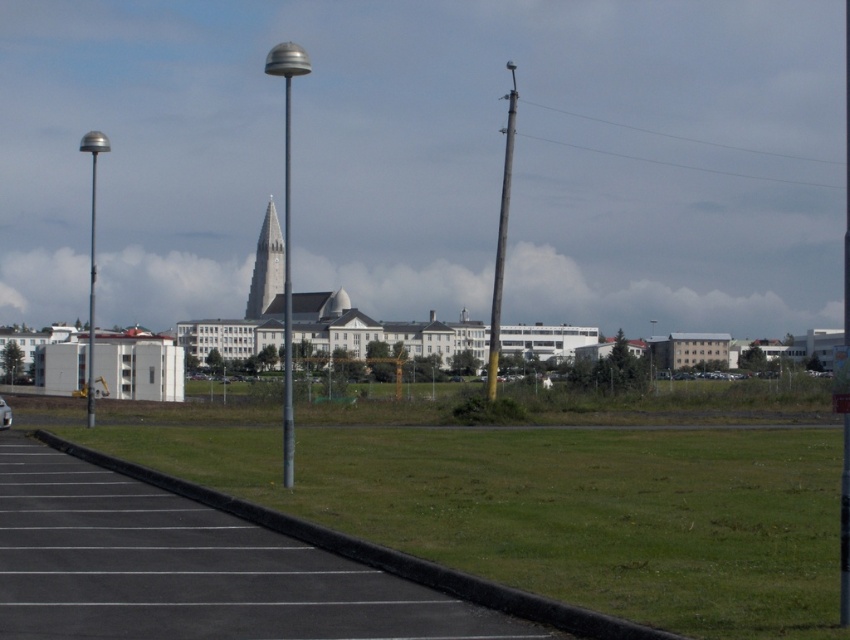
Can you confirm if smooth gray spire at center is positioned to the left of white glossy car at center?

Correct, you'll find smooth gray spire at center to the left of white glossy car at center.

Who is higher up, smooth gray spire at center or white glossy car at center?

smooth gray spire at center is higher up.

Is point (262, 284) in front of point (3, 426)?

That is False.

The height and width of the screenshot is (640, 850). I want to click on smooth gray spire at center, so click(265, 266).

Is black asphalt parking lot at lower left bigger than smooth gray spire at center?

No.

Between black asphalt parking lot at lower left and smooth gray spire at center, which one appears on the left side from the viewer's perspective?

smooth gray spire at center

The image size is (850, 640). What do you see at coordinates (188, 570) in the screenshot?
I see `black asphalt parking lot at lower left` at bounding box center [188, 570].

This screenshot has width=850, height=640. Identify the location of black asphalt parking lot at lower left. (188, 570).

Can you confirm if black asphalt parking lot at lower left is positioned to the right of silver metallic pole at left?

Correct, you'll find black asphalt parking lot at lower left to the right of silver metallic pole at left.

Does black asphalt parking lot at lower left have a greater width compared to silver metallic pole at left?

In fact, black asphalt parking lot at lower left might be narrower than silver metallic pole at left.

Which is in front, point (43, 588) or point (106, 140)?

Point (43, 588)

I want to click on black asphalt parking lot at lower left, so click(x=188, y=570).